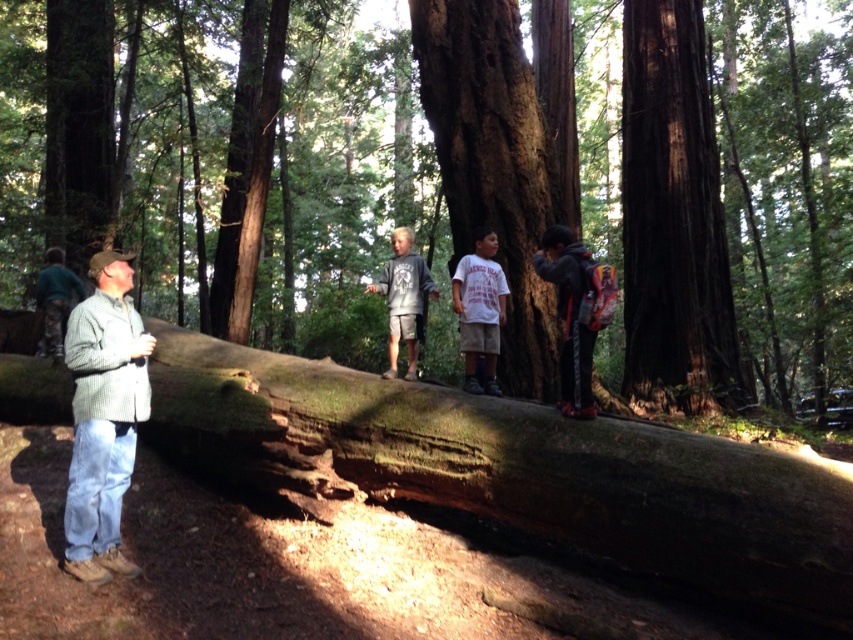
Question: In this image, where is dark gray hoodie at center located relative to white cotton shirt at center?

Choices:
 (A) right
 (B) left

Answer: (A)

Question: Which object is the farthest from the smooth brown log at center?

Choices:
 (A) gray cotton hoodie at center
 (B) dark brown wood at center
 (C) dark gray hoodie at center

Answer: (C)

Question: Is dark brown wood at center positioned behind white cotton shirt at center?

Choices:
 (A) yes
 (B) no

Answer: (A)

Question: Is dark gray hoodie at center below gray cotton hoodie at center?

Choices:
 (A) no
 (B) yes

Answer: (A)

Question: Which of the following is the farthest from the observer?

Choices:
 (A) (490, 285)
 (B) (152, 177)
 (C) (642, 96)

Answer: (B)

Question: Which point is closer to the camera?

Choices:
 (A) white cotton shirt at center
 (B) dark brown wood at center
 (C) dark gray hoodie at center
 (D) green plaid shirt at left

Answer: (D)